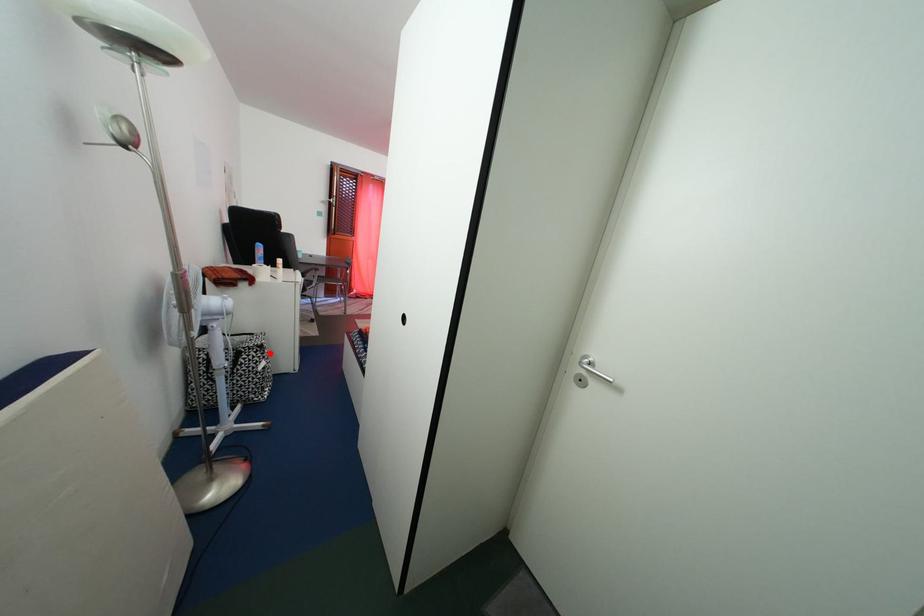
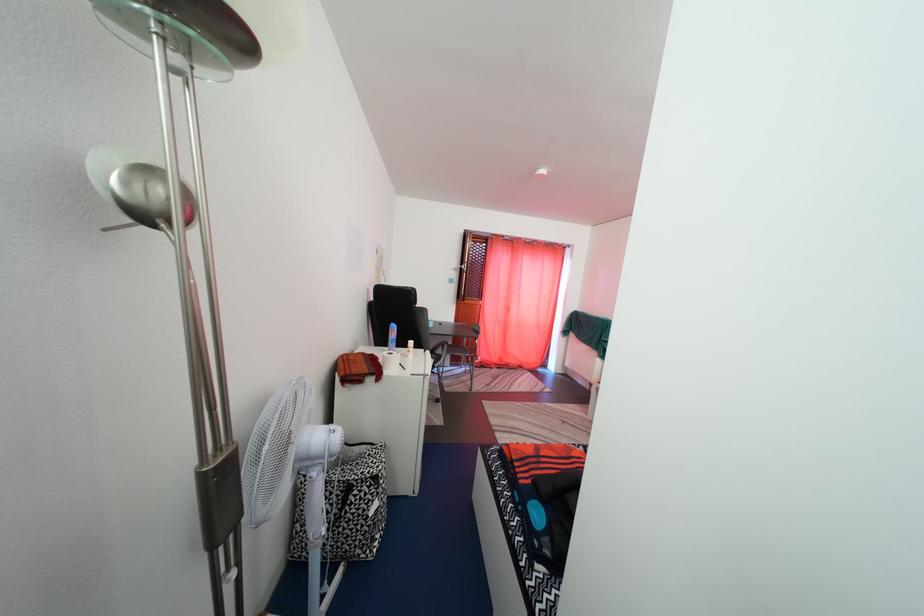
Find the pixel in the second image that matches the highlighted location in the first image.

(384, 485)